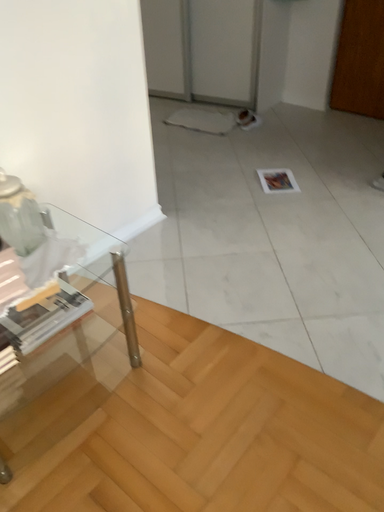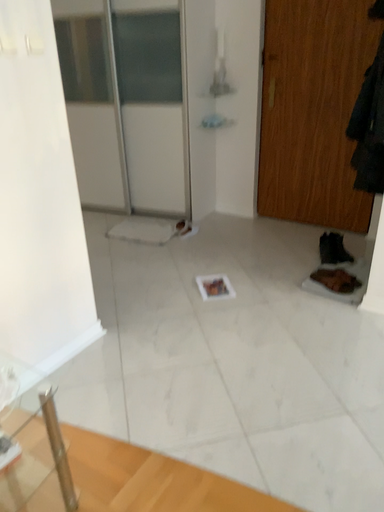
Question: Which way did the camera rotate in the video?

Choices:
 (A) rotated downward
 (B) rotated upward

Answer: (B)